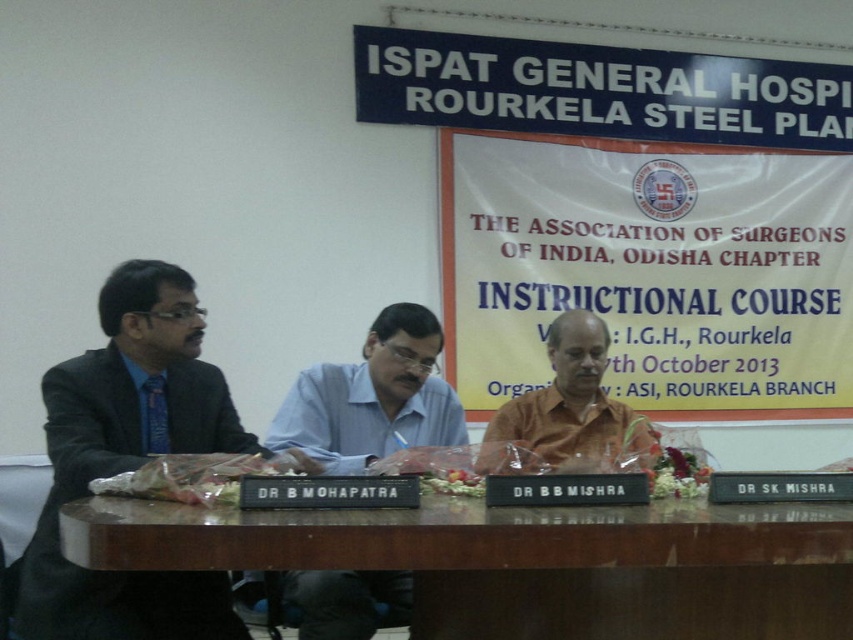
Does matte black suit at left appear under orange matte shirt at center?

Indeed, matte black suit at left is positioned under orange matte shirt at center.

Is the position of matte black suit at left more distant than that of orange matte shirt at center?

No, matte black suit at left is in front of orange matte shirt at center.

What do you see at coordinates (131, 461) in the screenshot?
I see `matte black suit at left` at bounding box center [131, 461].

In order to click on matte black suit at left in this screenshot , I will do `click(131, 461)`.

Is point (485, 625) positioned behind point (593, 412)?

No, (485, 625) is closer to viewer.

Which of these two, brown wooden table at center or orange matte shirt at center, stands taller?

Standing taller between the two is orange matte shirt at center.

Is point (80, 525) less distant than point (596, 324)?

Yes, point (80, 525) is closer to viewer.

Locate an element on the screen. brown wooden table at center is located at coordinates (524, 563).

Is yellow paper at center above brown wooden table at center?

Yes.

Is yellow paper at center to the left of brown wooden table at center from the viewer's perspective?

No, yellow paper at center is not to the left of brown wooden table at center.

Between point (608, 390) and point (112, 557), which one is positioned in front?

Point (112, 557) is in front.

This screenshot has width=853, height=640. Find the location of `yellow paper at center`. yellow paper at center is located at coordinates (650, 272).